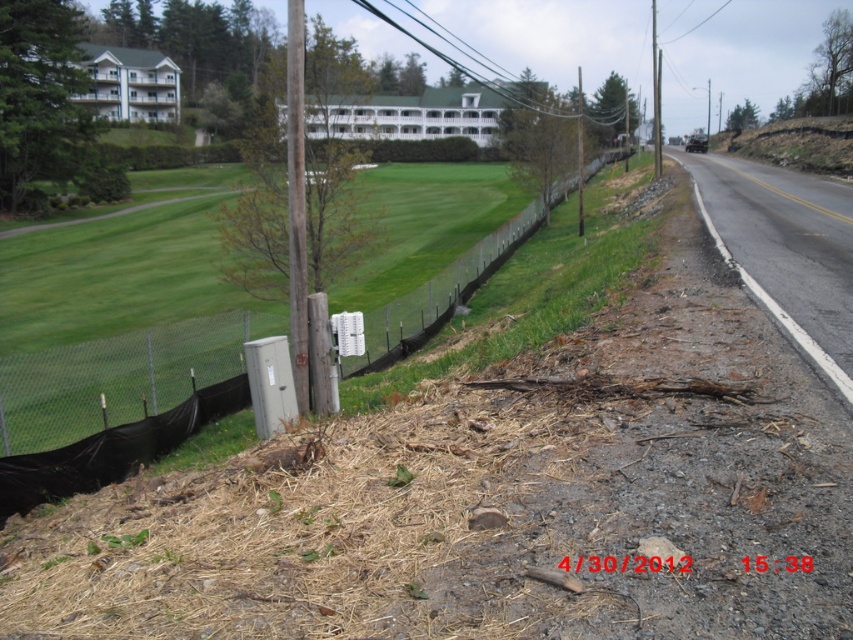
Based on the photo, which is more to the left, brown wood pole at center or smooth wooden post at center?

From the viewer's perspective, brown wood pole at center appears more on the left side.

Is the position of brown wood pole at center more distant than that of smooth wooden post at center?

No, it is not.

Does point (289, 61) lie in front of point (579, 164)?

That is True.

Find the location of `brown wood pole at center`. brown wood pole at center is located at coordinates (296, 204).

Is black mesh fence at center wider than smooth wooden post at center?

In fact, black mesh fence at center might be narrower than smooth wooden post at center.

Can you confirm if black mesh fence at center is taller than smooth wooden post at center?

In fact, black mesh fence at center may be shorter than smooth wooden post at center.

Is point (135, 440) more distant than point (578, 84)?

No.

You are a GUI agent. You are given a task and a screenshot of the screen. Output one action in this format:
    pyautogui.click(x=<x>, y=<y>)
    Task: Click on the black mesh fence at center
    
    Given the screenshot: What is the action you would take?
    pyautogui.click(x=112, y=449)

Which is more to the left, black mesh fence at center or brown wood pole at center?

brown wood pole at center

Which is behind, point (590, 170) or point (288, 186)?

The point (590, 170) is more distant.

The width and height of the screenshot is (853, 640). In order to click on black mesh fence at center in this screenshot , I will do `click(112, 449)`.